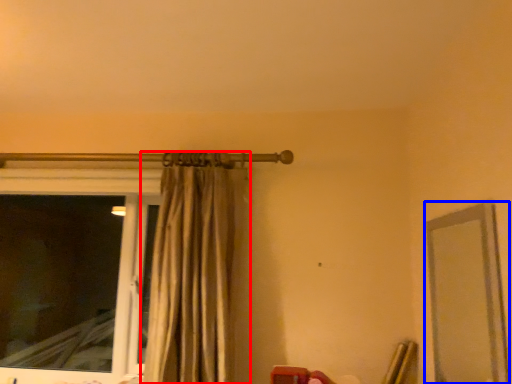
Question: Which object appears closest to the camera in this image, curtain (highlighted by a red box) or mirror (highlighted by a blue box)?

Choices:
 (A) curtain
 (B) mirror

Answer: (B)